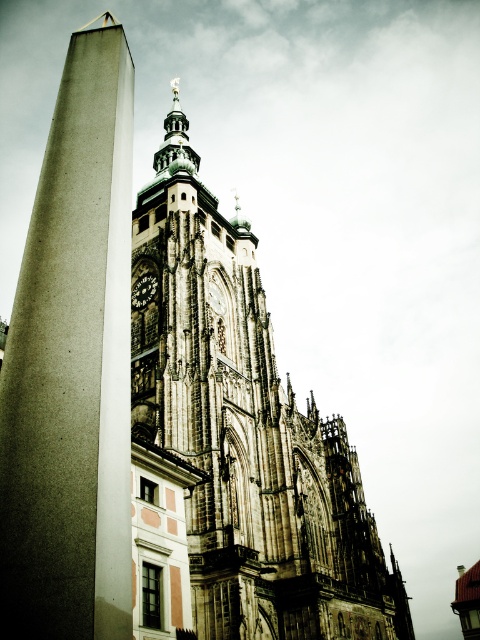
Can you confirm if smooth concrete pillar at left is wider than dark gray stone clock at upper center?

Correct, the width of smooth concrete pillar at left exceeds that of dark gray stone clock at upper center.

The height and width of the screenshot is (640, 480). I want to click on smooth concrete pillar at left, so (x=72, y=365).

Does point (13, 628) lie in front of point (142, 284)?

Yes, it is.

This screenshot has height=640, width=480. I want to click on smooth concrete pillar at left, so click(x=72, y=365).

Between brown stone tower at center and dark gray stone clock at upper center, which one is positioned lower?

dark gray stone clock at upper center is lower down.

Does brown stone tower at center have a larger size compared to dark gray stone clock at upper center?

Yes, brown stone tower at center is bigger than dark gray stone clock at upper center.

Does point (301, 419) lie in front of point (146, 280)?

No, (301, 419) is behind (146, 280).

The width and height of the screenshot is (480, 640). In order to click on brown stone tower at center in this screenshot , I will do `click(245, 433)`.

Is point (173, 348) less distant than point (3, 371)?

No, (173, 348) is further to viewer.

Describe the element at coordinates (245, 433) in the screenshot. I see `brown stone tower at center` at that location.

Locate an element on the screen. This screenshot has height=640, width=480. brown stone tower at center is located at coordinates (245, 433).